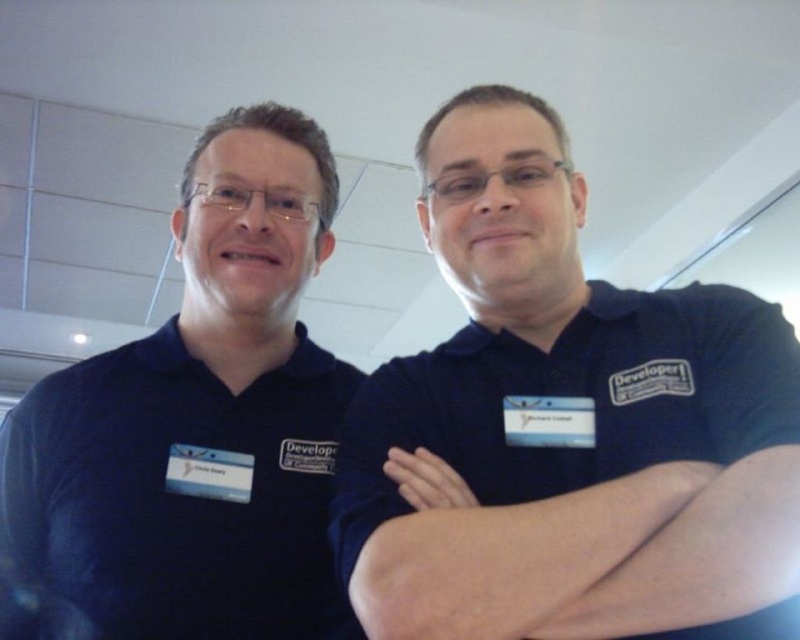
Which is below, dark blue shirt at center or dark blue shirt at left?

dark blue shirt at left

Who is positioned more to the right, dark blue shirt at center or dark blue shirt at left?

From the viewer's perspective, dark blue shirt at center appears more on the right side.

Locate an element on the screen. The width and height of the screenshot is (800, 640). dark blue shirt at center is located at coordinates (566, 422).